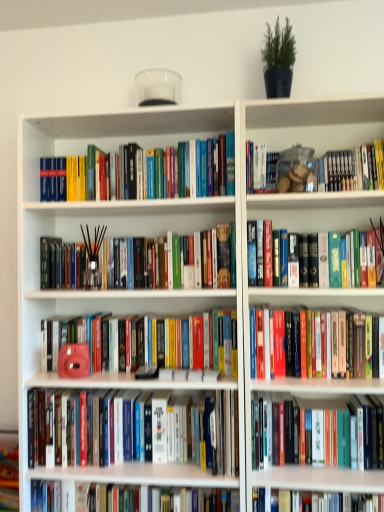
You are a GUI agent. You are given a task and a screenshot of the screen. Output one action in this format:
    pyautogui.click(x=<x>, y=<y>)
    Task: Click on the vacant area on top of hardcover books at center, which ranks as the 5th book in bottom-to-top order (from a real-world perspective)
    
    Given the screenshot: What is the action you would take?
    pyautogui.click(x=314, y=302)